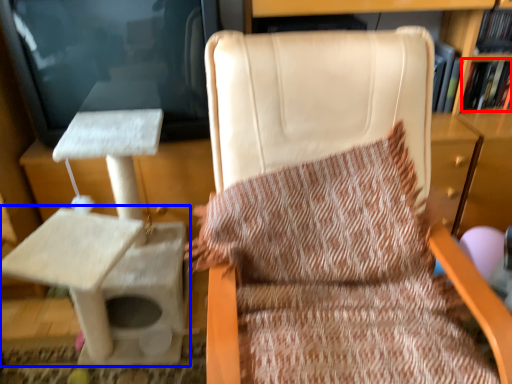
Question: Among these objects, which one is farthest to the camera, book (highlighted by a red box) or table (highlighted by a blue box)?

Choices:
 (A) book
 (B) table

Answer: (A)